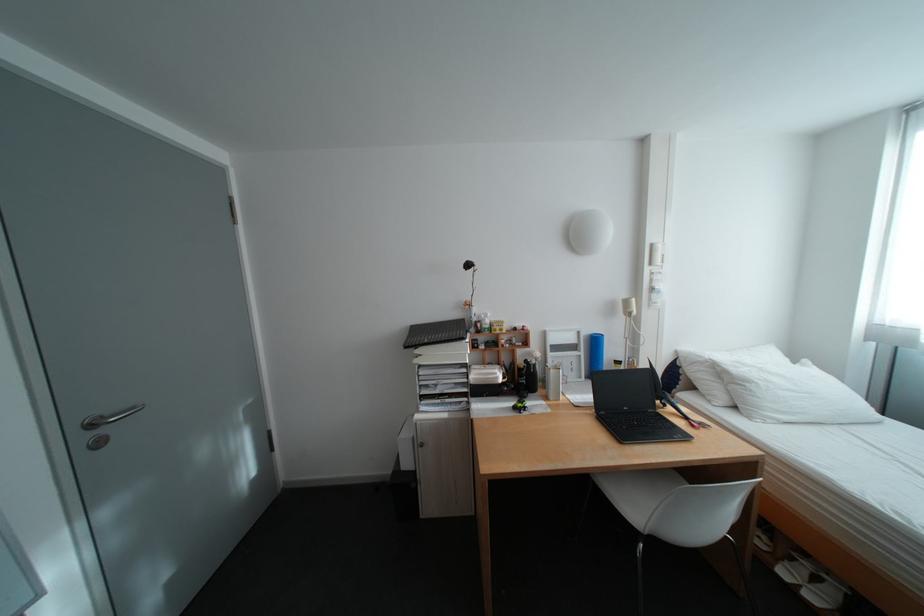
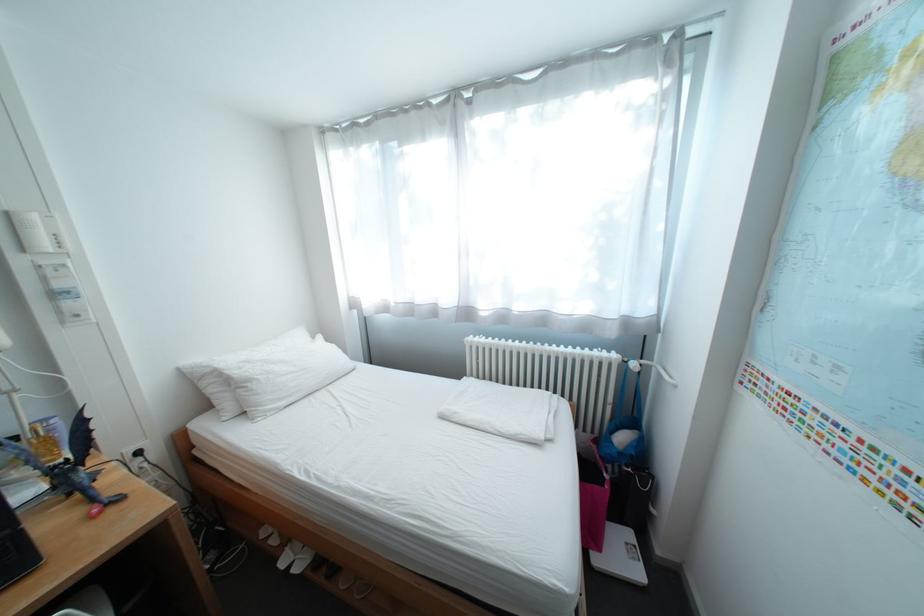
Where in the second image is the point corresponding to point 813,586 from the first image?

(307, 562)